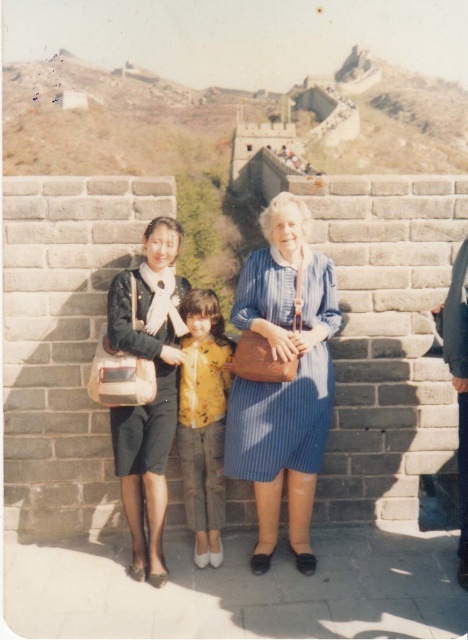
Question: Which of the following is the closest to the observer?

Choices:
 (A) (121, 276)
 (B) (194, 445)

Answer: (A)

Question: Which object is positioned farthest from the matte blue dress at center?

Choices:
 (A) yellow matte shirt at center
 (B) blue striped dress at center

Answer: (B)

Question: Which object is positioned farthest from the yellow matte shirt at center?

Choices:
 (A) blue striped dress at center
 (B) matte blue dress at center

Answer: (A)

Question: Can you confirm if matte blue dress at center is thinner than yellow matte shirt at center?

Choices:
 (A) no
 (B) yes

Answer: (A)

Question: Is blue striped dress at center further to camera compared to yellow matte shirt at center?

Choices:
 (A) no
 (B) yes

Answer: (A)

Question: Is blue striped dress at center below matte blue dress at center?

Choices:
 (A) no
 (B) yes

Answer: (A)